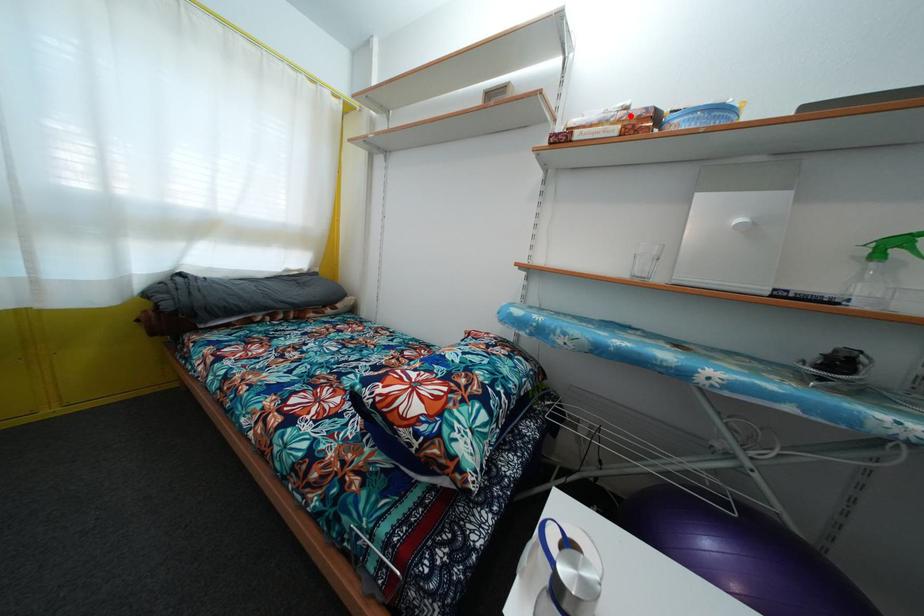
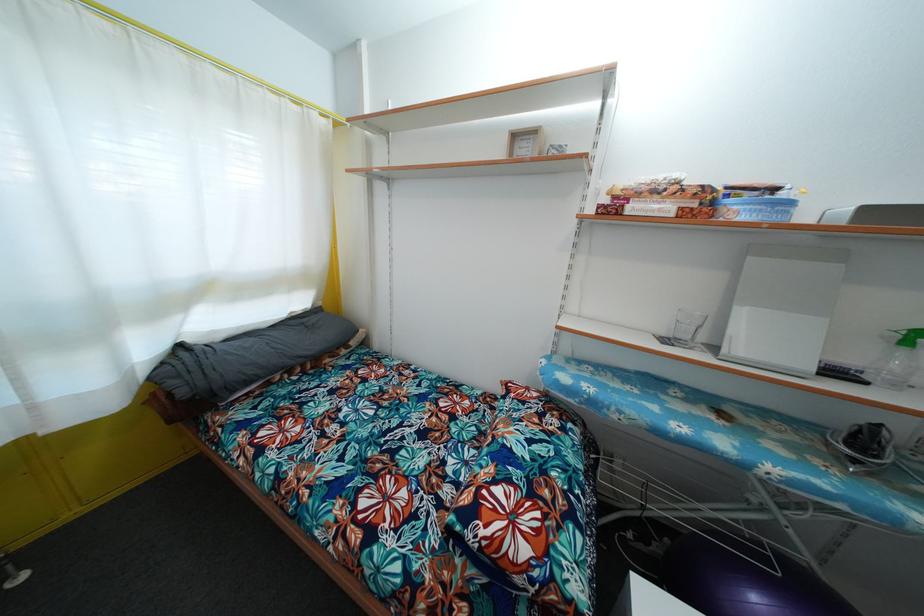
Where in the second image is the point corresponding to the highlighted location from the first image?

(683, 188)